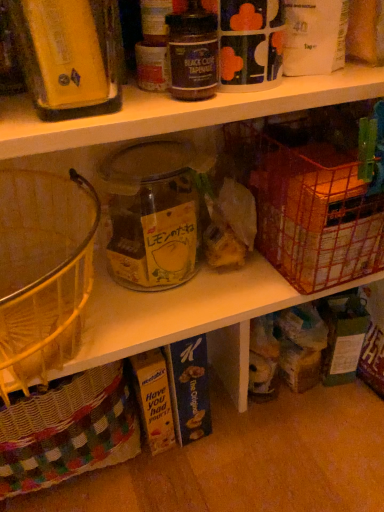
This screenshot has width=384, height=512. What are the coordinates of `empty space that is ontop of metallic wire basket at right (from a real-world perspective)` in the screenshot? It's located at (326, 155).